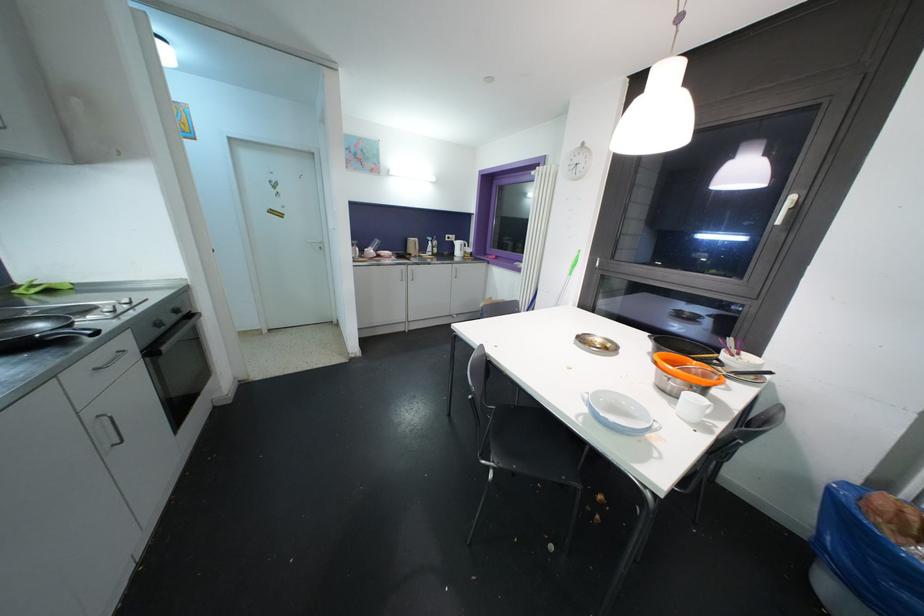
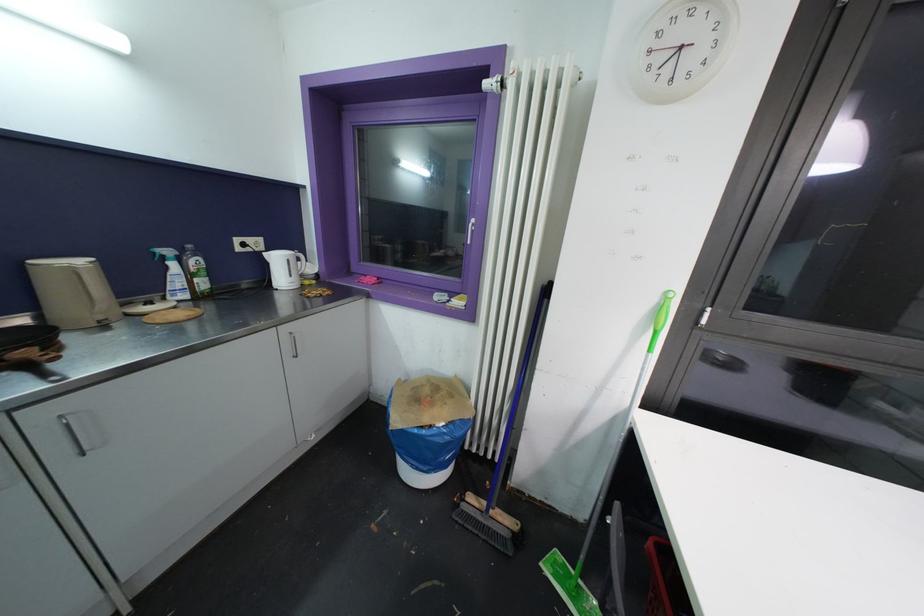
Find the pixel in the second image that matches pixel 433 246 in the first image.

(176, 267)